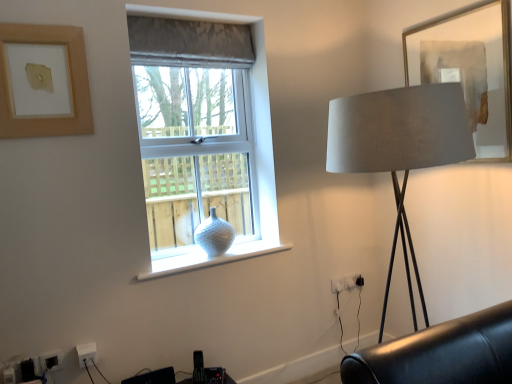
Identify the location of empty space that is ontop of white glossy vase at center (from a real-world perspective). point(206,254).